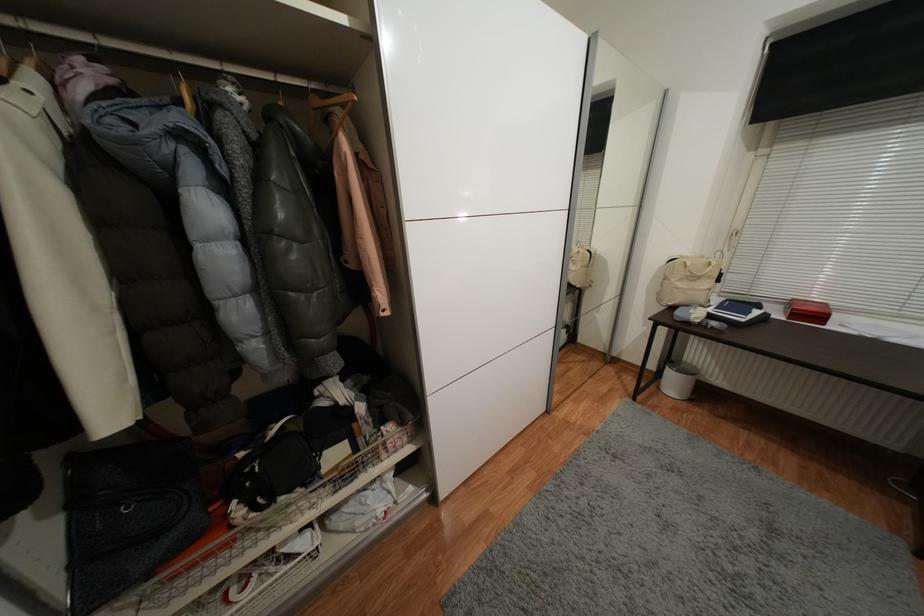
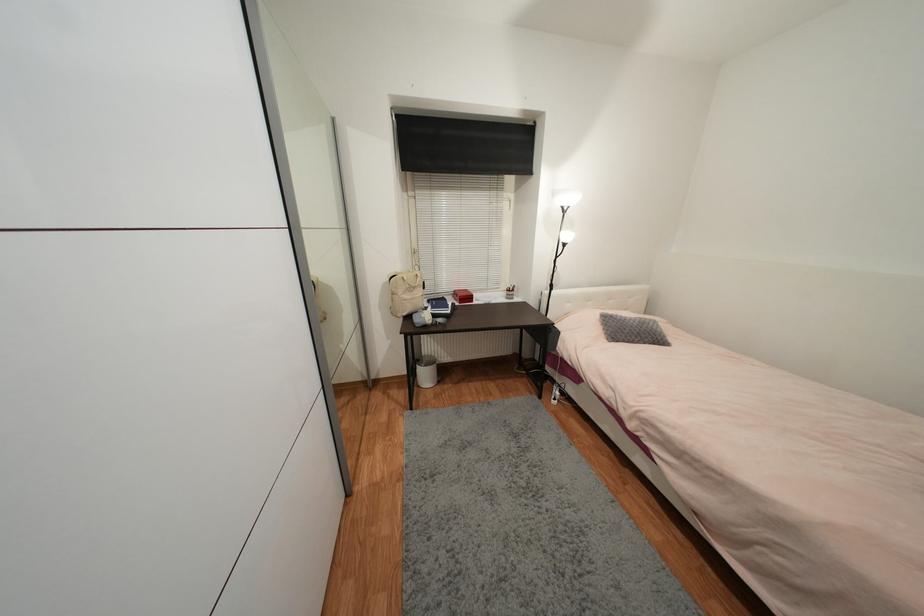
Question: The camera is either moving clockwise (left) or counter-clockwise (right) around the object. The first image is from the beginning of the video and the second image is from the end. Is the camera moving left or right when shooting the video?

Choices:
 (A) Left
 (B) Right

Answer: (A)